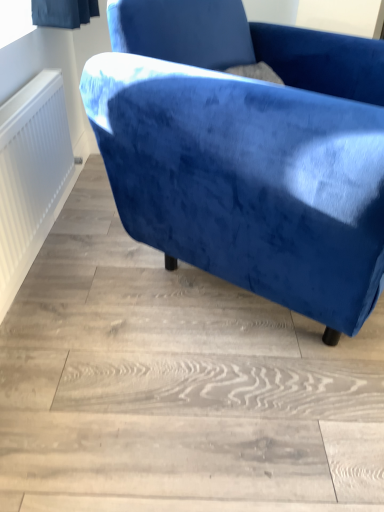
The height and width of the screenshot is (512, 384). Find the location of `vacant area situated to the left side of velvet blue armchair at upper right`. vacant area situated to the left side of velvet blue armchair at upper right is located at coordinates (82, 281).